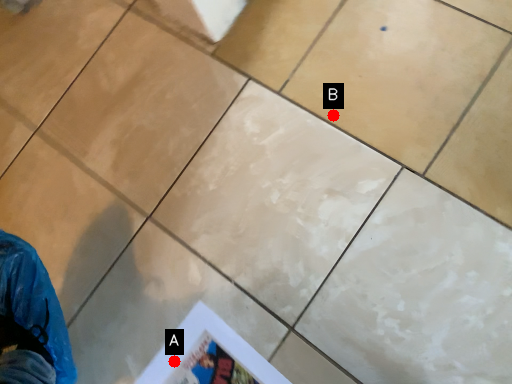
Question: Two points are circled on the image, labeled by A and B beside each circle. Which point is closer to the camera?

Choices:
 (A) A is closer
 (B) B is closer

Answer: (A)